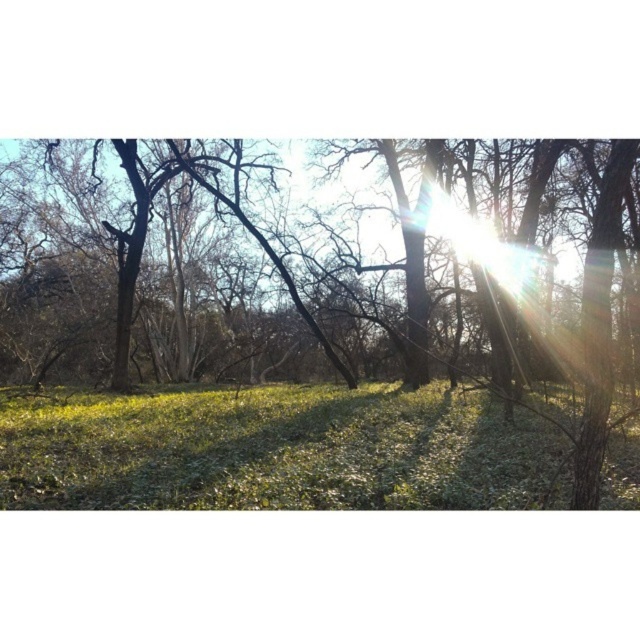
Between point (288, 438) and point (404, 496), which one is positioned in front?

Point (404, 496)

Is green leafy tree at center above green matte grass at center?

Yes, green leafy tree at center is above green matte grass at center.

Between point (84, 500) and point (499, 484), which one is positioned behind?

The point (499, 484) is more distant.

This screenshot has height=640, width=640. Find the location of `green leafy tree at center`. green leafy tree at center is located at coordinates (292, 353).